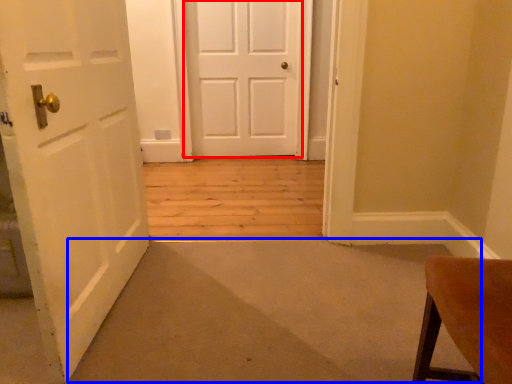
Question: Which object appears closest to the camera in this image, door (highlighted by a red box) or door (highlighted by a blue box)?

Choices:
 (A) door
 (B) door

Answer: (B)